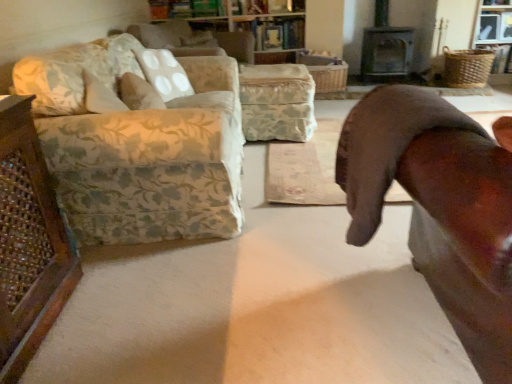
In order to face wooden bookshelf at upper center, should I rotate leftwards or rightwards?

To face it directly, rotate left by 3.797 degrees.

At what (x,y) coordinates should I click in order to perform the action: click on wooden bookshelf at upper center. Please return your answer as a coordinate pair (x, y). The image size is (512, 384). Looking at the image, I should click on (258, 32).

In order to face floral fabric couch at left, should I rotate leftwards or rightwards?

Turn left approximately 12.460 degrees to face it.

The height and width of the screenshot is (384, 512). I want to click on metallic gray fireplace at upper right, so pos(386,52).

Where is `floral fabric pillow at upper left, the first pillow when ordered from bottom to top`? floral fabric pillow at upper left, the first pillow when ordered from bottom to top is located at coordinates (139, 93).

Is white dotted fabric pillow at upper center, which is the 2th pillow from front to back, in contact with brown leather chair at right?

They are not placed beside each other.

Is white dotted fabric pillow at upper center, the first pillow positioned from the back, to the left or to the right of brown leather chair at right in the image?

Clearly, white dotted fabric pillow at upper center, the first pillow positioned from the back, is on the left of brown leather chair at right in the image.

From the image's perspective, which is above, white dotted fabric pillow at upper center, which is the 2th pillow from front to back, or brown leather chair at right?

white dotted fabric pillow at upper center, which is the 2th pillow from front to back, appears higher in the image.

Is floral fabric couch at left positioned with its back to metallic gray fireplace at upper right?

That's not correct — floral fabric couch at left is not looking away from metallic gray fireplace at upper right.

Is floral fabric couch at left not close to metallic gray fireplace at upper right?

Yes, floral fabric couch at left is far from metallic gray fireplace at upper right.

From the image's perspective, is floral fabric couch at left beneath metallic gray fireplace at upper right?

Indeed, from the image's perspective, floral fabric couch at left is shown beneath metallic gray fireplace at upper right.

Which object is more forward, brown leather chair at right or white dotted fabric pillow at upper center, marked as the 2th pillow in a bottom-to-top arrangement?

brown leather chair at right.

Who is bigger, brown leather chair at right or white dotted fabric pillow at upper center, which is the 2th pillow from front to back?

With larger size is brown leather chair at right.

From the picture: Is brown leather chair at right positioned far away from white dotted fabric pillow at upper center, the first pillow positioned from the back?

brown leather chair at right is far away from white dotted fabric pillow at upper center, the first pillow positioned from the back.

Visually, is brown leather chair at right positioned to the left or to the right of white dotted fabric pillow at upper center, the first pillow viewed from the top?

brown leather chair at right is positioned on white dotted fabric pillow at upper center, the first pillow viewed from the top,'s right side.

From the picture: Which of these two, white dotted fabric pillow at upper center, the first pillow positioned from the back, or wooden bookshelf at upper center, stands shorter?

Standing shorter between the two is white dotted fabric pillow at upper center, the first pillow positioned from the back.

Is white dotted fabric pillow at upper center, which is the 2th pillow from front to back, oriented away from wooden bookshelf at upper center?

No, white dotted fabric pillow at upper center, which is the 2th pillow from front to back, is not facing the opposite direction of wooden bookshelf at upper center.

What are the coordinates of `cabinetry on the right of white dotted fabric pillow at upper center, the first pillow positioned from the back` in the screenshot? It's located at (258, 32).

Is wooden bookshelf at upper center completely or partially inside white dotted fabric pillow at upper center, the first pillow positioned from the back?

No, white dotted fabric pillow at upper center, the first pillow positioned from the back, does not contain wooden bookshelf at upper center.

Can you confirm if floral fabric couch at left is taller than brown leather chair at right?

In fact, floral fabric couch at left may be shorter than brown leather chair at right.

Considering the positions of objects floral fabric couch at left and brown leather chair at right in the image provided, who is in front, floral fabric couch at left or brown leather chair at right?

Positioned in front is brown leather chair at right.

Does floral fabric couch at left have a greater width compared to brown leather chair at right?

No, floral fabric couch at left is not wider than brown leather chair at right.

Locate an element on the screen. The height and width of the screenshot is (384, 512). chair on the right of the floral fabric couch at left is located at coordinates (439, 209).

Identify the location of fireplace above the floral fabric couch at left (from a real-world perspective). (386, 52).

Is metallic gray fireplace at upper right not inside floral fabric couch at left?

Yes.

Consider the image. From a real-world perspective, is metallic gray fireplace at upper right physically located above or below floral fabric couch at left?

From a real-world perspective, metallic gray fireplace at upper right is physically above floral fabric couch at left.

Which is behind, brown leather chair at right or floral fabric pillow at upper left, the first pillow when ordered from front to back?

Positioned behind is floral fabric pillow at upper left, the first pillow when ordered from front to back.

Is point (466, 257) in front of point (122, 84)?

Yes, it is in front of point (122, 84).

Is floral fabric pillow at upper left, the second pillow in the back-to-front sequence, located within brown leather chair at right?

No, floral fabric pillow at upper left, the second pillow in the back-to-front sequence, is located outside of brown leather chair at right.

Find the location of a particular element. This screenshot has width=512, height=384. chair in front of the white dotted fabric pillow at upper center, the first pillow viewed from the top is located at coordinates (439, 209).

What are the coordinates of `fireplace that is behind the floral fabric couch at left` in the screenshot? It's located at (386, 52).

From the image, which object appears to be farther from brown leather chair at right, floral fabric pillow at upper left, the second pillow in the back-to-front sequence, or white dotted fabric pillow at upper center, the first pillow positioned from the back?

white dotted fabric pillow at upper center, the first pillow positioned from the back, is further to brown leather chair at right.

Based on their spatial positions, is floral fabric pillow at upper left, the second pillow in the back-to-front sequence, or brown leather chair at right closer to metallic gray fireplace at upper right?

The object closer to metallic gray fireplace at upper right is floral fabric pillow at upper left, the second pillow in the back-to-front sequence.

Which object lies nearer to the anchor point brown leather chair at right, metallic gray fireplace at upper right or wooden bookshelf at upper center?

wooden bookshelf at upper center is positioned closer to the anchor brown leather chair at right.

Based on their spatial positions, is floral fabric couch at left or wooden bookshelf at upper center closer to white dotted fabric pillow at upper center, marked as the 2th pillow in a bottom-to-top arrangement?

wooden bookshelf at upper center is positioned closer to the anchor white dotted fabric pillow at upper center, marked as the 2th pillow in a bottom-to-top arrangement.

Which object lies further to the anchor point white dotted fabric pillow at upper center, marked as the 2th pillow in a bottom-to-top arrangement, floral fabric pillow at upper left, positioned as the 2th pillow in top-to-bottom order, or metallic gray fireplace at upper right?

floral fabric pillow at upper left, positioned as the 2th pillow in top-to-bottom order.

Looking at the image, which one is located closer to floral fabric pillow at upper left, the first pillow when ordered from bottom to top, floral fabric couch at left or white dotted fabric pillow at upper center, the first pillow viewed from the top?

The object closer to floral fabric pillow at upper left, the first pillow when ordered from bottom to top, is floral fabric couch at left.

Considering their positions, is wooden bookshelf at upper center positioned further to brown leather chair at right than floral fabric couch at left?

Based on the image, wooden bookshelf at upper center appears to be further to brown leather chair at right.

From the image, which object appears to be farther from wooden bookshelf at upper center, floral fabric pillow at upper left, the first pillow when ordered from bottom to top, or floral fabric couch at left?

floral fabric pillow at upper left, the first pillow when ordered from bottom to top, is further to wooden bookshelf at upper center.

At what (x,y) coordinates should I click in order to perform the action: click on pillow between floral fabric couch at left and white dotted fabric pillow at upper center, the first pillow positioned from the back, along the z-axis. Please return your answer as a coordinate pair (x, y). Looking at the image, I should click on (139, 93).

What are the coordinates of `fireplace located between brown leather chair at right and wooden bookshelf at upper center in the depth direction` in the screenshot? It's located at (386, 52).

Where is `fireplace between floral fabric couch at left and wooden bookshelf at upper center along the z-axis`? This screenshot has width=512, height=384. fireplace between floral fabric couch at left and wooden bookshelf at upper center along the z-axis is located at coordinates (386, 52).

Identify the location of cabinetry between white dotted fabric pillow at upper center, marked as the 2th pillow in a bottom-to-top arrangement, and metallic gray fireplace at upper right from left to right. This screenshot has width=512, height=384. (258, 32).